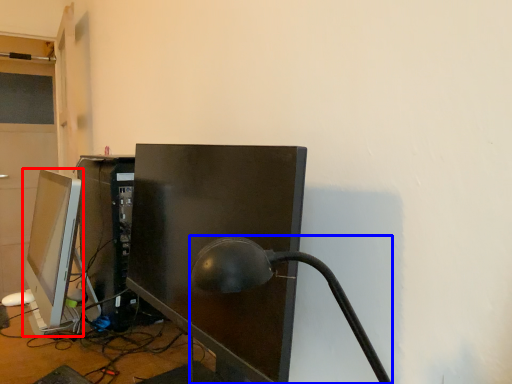
Question: Which object is closer to the camera taking this photo, computer monitor (highlighted by a red box) or table lamp (highlighted by a blue box)?

Choices:
 (A) computer monitor
 (B) table lamp

Answer: (B)